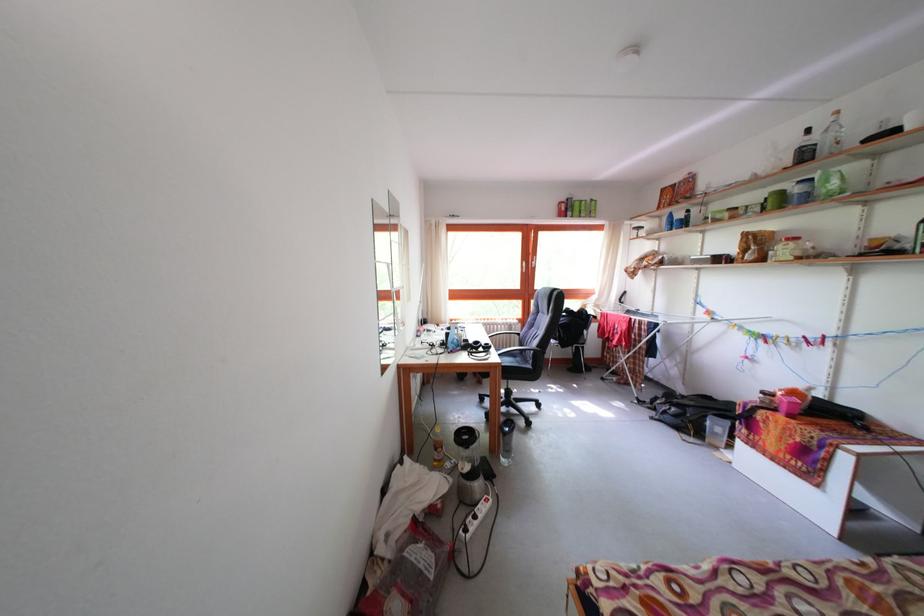
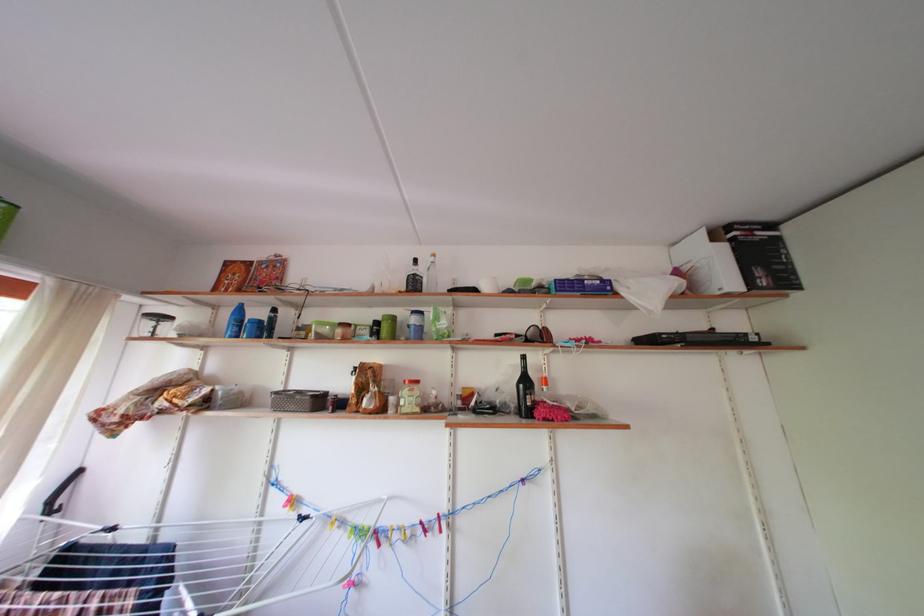
The point at (675, 217) is marked in the first image. Where is the corresponding point in the second image?

(242, 305)